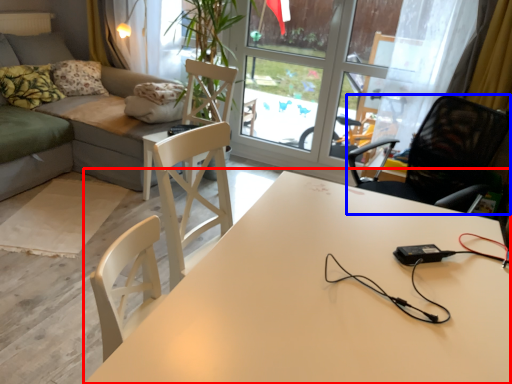
Question: Which point is closer to the camera, table (highlighted by a red box) or chair (highlighted by a blue box)?

Choices:
 (A) table
 (B) chair

Answer: (A)